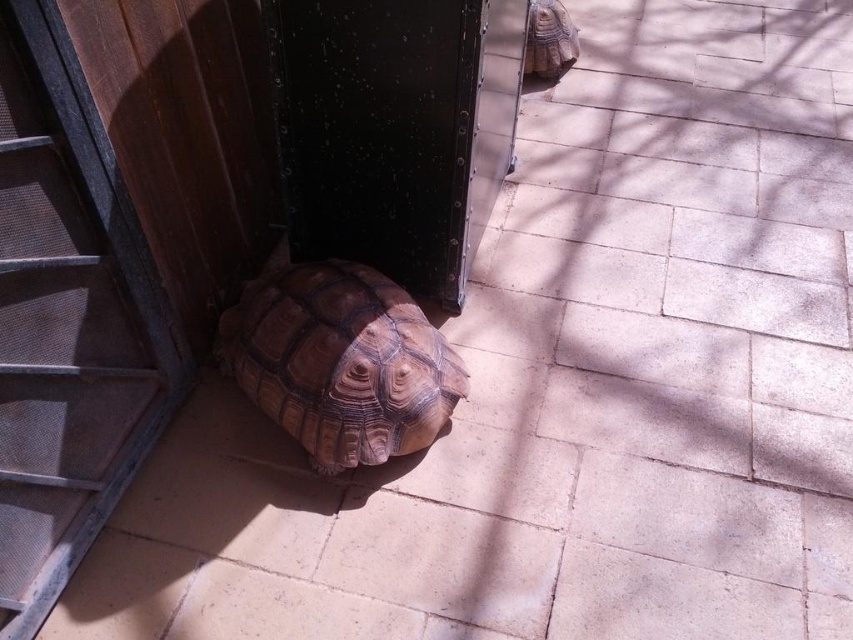
Which is in front, point (79, 241) or point (531, 12)?

Positioned in front is point (79, 241).

At what (x,y) coordinates should I click in order to perform the action: click on transparent glass door at lower left. Please return your answer as a coordinate pair (x, y). The height and width of the screenshot is (640, 853). Looking at the image, I should click on (67, 321).

Where is `transparent glass door at lower left`? transparent glass door at lower left is located at coordinates (67, 321).

Which of these two, brown textured tortoise at lower left or brown textured tortoise at upper right, stands taller?

With more height is brown textured tortoise at lower left.

Between point (323, 412) and point (535, 54), which one is positioned behind?

The point (535, 54) is more distant.

This screenshot has height=640, width=853. I want to click on brown textured tortoise at lower left, so click(340, 362).

Can you confirm if transparent glass door at lower left is positioned to the left of brown textured tortoise at lower left?

Indeed, transparent glass door at lower left is positioned on the left side of brown textured tortoise at lower left.

Is point (64, 448) positioned before point (305, 424)?

Yes, point (64, 448) is closer to viewer.

Where is `transparent glass door at lower left`? transparent glass door at lower left is located at coordinates (67, 321).